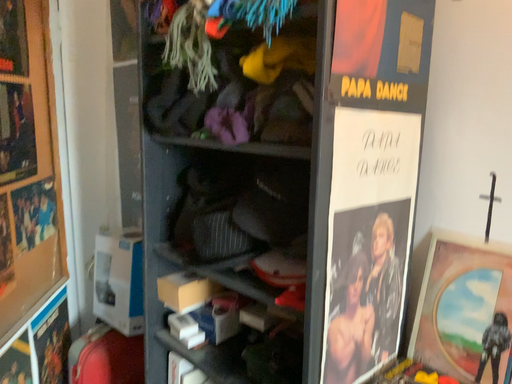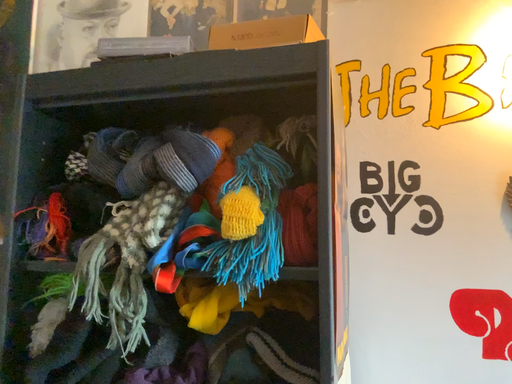
Question: How did the camera likely rotate when shooting the video?

Choices:
 (A) rotated left
 (B) rotated right

Answer: (B)